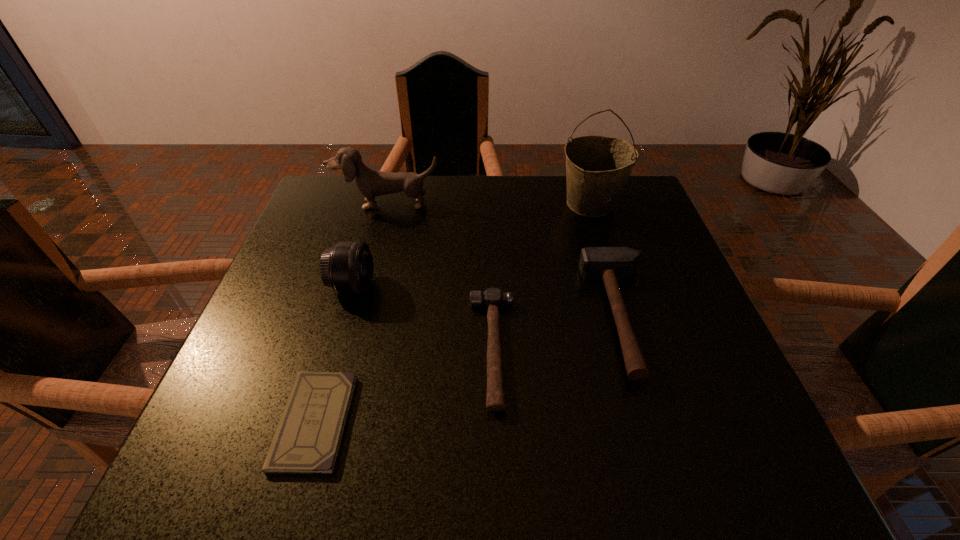
Locate an element on the screen. The image size is (960, 540). vacant area between the shorter hammer and the shortest object is located at coordinates (404, 385).

Select which object appears as the closest to the taller hammer. Please provide its 2D coordinates. Your answer should be formatted as a tuple, i.e. [(x, y)], where the tuple contains the x and y coordinates of a point satisfying the conditions above.

[(597, 167)]

What are the coordinates of `object that is the fifth closest one to the right hammer` in the screenshot? It's located at (348, 267).

The width and height of the screenshot is (960, 540). Find the location of `free space that satisfies the following two spatial constraints: 1. on the back side of the shortest object; 2. on the right side of the wine bucket`. free space that satisfies the following two spatial constraints: 1. on the back side of the shortest object; 2. on the right side of the wine bucket is located at coordinates (378, 204).

Locate an element on the screen. This screenshot has width=960, height=540. blank area in the image that satisfies the following two spatial constraints: 1. at the face of the second tallest object; 2. on the front-facing side of the third tallest object is located at coordinates (365, 286).

Where is `vacant area that satisfies the following two spatial constraints: 1. on the front side of the tallest object; 2. on the striking face of the third object from right to left`? vacant area that satisfies the following two spatial constraints: 1. on the front side of the tallest object; 2. on the striking face of the third object from right to left is located at coordinates 636,349.